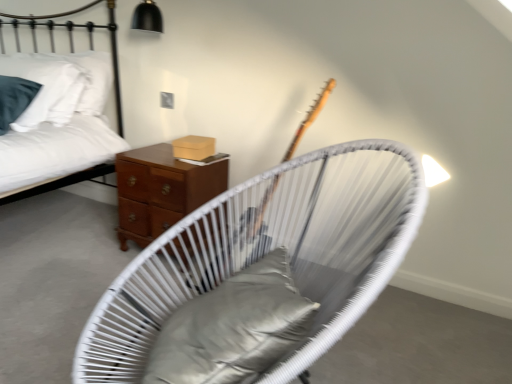
The image size is (512, 384). Describe the element at coordinates (270, 251) in the screenshot. I see `white woven chair at center` at that location.

The image size is (512, 384). I want to click on mahogany wood nightstand at center, so click(161, 191).

The height and width of the screenshot is (384, 512). Describe the element at coordinates (233, 327) in the screenshot. I see `satin gray pillow at center` at that location.

Find the location of `satin gray pillow at center`. satin gray pillow at center is located at coordinates (233, 327).

Image resolution: width=512 pixels, height=384 pixels. I want to click on white cotton bed at upper left, so click(x=89, y=43).

In the scene shown: Which object is closer to the camera, white woven chair at center or satin gray pillow at center?

white woven chair at center is in front.

Is white woven chair at center inside the boundaries of satin gray pillow at center, or outside?

white woven chair at center is not inside satin gray pillow at center, it's outside.

From a real-world perspective, between white woven chair at center and satin gray pillow at center, who is vertically lower?

In real-world perspective, white woven chair at center is lower.

Is white cotton bed at upper left facing away from satin gray pillow at center?

No, white cotton bed at upper left is not facing away from satin gray pillow at center.

Consider the image. Is white cotton bed at upper left completely or partially outside of satin gray pillow at center?

Answer: white cotton bed at upper left is positioned outside satin gray pillow at center.

Would you consider white cotton bed at upper left to be distant from satin gray pillow at center?

That's right, there is a large distance between white cotton bed at upper left and satin gray pillow at center.

Does white cotton bed at upper left lie in front of satin gray pillow at center?

No, white cotton bed at upper left is further to the viewer.

Does point (223, 320) come farther from viewer compared to point (168, 222)?

No, (223, 320) is in front of (168, 222).

From a real-world perspective, between satin gray pillow at center and mahogany wood nightstand at center, who is vertically higher?

In real-world perspective, satin gray pillow at center is above.

From the image's perspective, is satin gray pillow at center positioned above or below mahogany wood nightstand at center?

From the image's perspective, satin gray pillow at center appears below mahogany wood nightstand at center.

Is satin gray pillow at center oriented away from mahogany wood nightstand at center?

No, satin gray pillow at center's orientation is not away from mahogany wood nightstand at center.

Locate an element on the screen. The height and width of the screenshot is (384, 512). nightstand that appears behind the white cotton bed at upper left is located at coordinates (161, 191).

Is white cotton bed at upper left to the left or to the right of mahogany wood nightstand at center in the image?

Based on their positions, white cotton bed at upper left is located to the left of mahogany wood nightstand at center.

Considering the relative sizes of white cotton bed at upper left and mahogany wood nightstand at center in the image provided, is white cotton bed at upper left smaller than mahogany wood nightstand at center?

Incorrect, white cotton bed at upper left is not smaller in size than mahogany wood nightstand at center.

From the image's perspective, is white woven chair at center above or below white cotton bed at upper left?

From the image's perspective, white woven chair at center appears below white cotton bed at upper left.

Between white woven chair at center and white cotton bed at upper left, which one has less height?

white cotton bed at upper left.

Is the position of white woven chair at center less distant than that of white cotton bed at upper left?

Yes, the depth of white woven chair at center is less than that of white cotton bed at upper left.

Does satin gray pillow at center lie in front of white cotton bed at upper left?

Yes.

Is satin gray pillow at center positioned beyond the bounds of white cotton bed at upper left?

That's correct, satin gray pillow at center is outside of white cotton bed at upper left.

Which point is more forward, (233,341) or (3,46)?

Point (233,341)

From a real-world perspective, does satin gray pillow at center stand above white cotton bed at upper left?

No, from a real-world perspective, satin gray pillow at center is not on top of white cotton bed at upper left.

Could you tell me if satin gray pillow at center is facing white woven chair at center?

Yes, satin gray pillow at center is oriented towards white woven chair at center.

From the image's perspective, is satin gray pillow at center over white woven chair at center?

Yes, from the image's perspective, satin gray pillow at center is on top of white woven chair at center.

Is the depth of satin gray pillow at center less than that of white woven chair at center?

No, the depth of satin gray pillow at center is greater than that of white woven chair at center.

Does point (206, 336) lie behind point (79, 357)?

No, it is not.

The image size is (512, 384). I want to click on furniture lying in front of the satin gray pillow at center, so click(x=270, y=251).

What are the coordinates of `pillow located on the right of white cotton bed at upper left` in the screenshot? It's located at pyautogui.click(x=233, y=327).

Estimate the real-world distances between objects in this image. Which object is closer to white cotton bed at upper left, satin gray pillow at center or white woven chair at center?

Based on the image, white woven chair at center appears to be nearer to white cotton bed at upper left.

Looking at the image, which one is located further to mahogany wood nightstand at center, white cotton bed at upper left or white woven chair at center?

white woven chair at center lies further to mahogany wood nightstand at center than the other object.

Looking at the image, which one is located closer to satin gray pillow at center, white woven chair at center or white cotton bed at upper left?

white woven chair at center is positioned closer to the anchor satin gray pillow at center.

Looking at the image, which one is located closer to white woven chair at center, mahogany wood nightstand at center or satin gray pillow at center?

satin gray pillow at center lies closer to white woven chair at center than the other object.

When comparing their distances from white woven chair at center, does satin gray pillow at center or white cotton bed at upper left seem closer?

satin gray pillow at center lies closer to white woven chair at center than the other object.

From the image, which object appears to be farther from mahogany wood nightstand at center, satin gray pillow at center or white woven chair at center?

satin gray pillow at center.

Based on their spatial positions, is white cotton bed at upper left or white woven chair at center closer to satin gray pillow at center?

The object closer to satin gray pillow at center is white woven chair at center.

Considering their positions, is white woven chair at center positioned further to satin gray pillow at center than mahogany wood nightstand at center?

Among the two, mahogany wood nightstand at center is located further to satin gray pillow at center.

Where is `pillow between white woven chair at center and mahogany wood nightstand at center in the front-back direction`? pillow between white woven chair at center and mahogany wood nightstand at center in the front-back direction is located at coordinates (233, 327).

Where is `nightstand situated between white cotton bed at upper left and satin gray pillow at center from left to right`? nightstand situated between white cotton bed at upper left and satin gray pillow at center from left to right is located at coordinates (161, 191).

Where is `bed between white woven chair at center and mahogany wood nightstand at center in the front-back direction`? bed between white woven chair at center and mahogany wood nightstand at center in the front-back direction is located at coordinates (89, 43).

Identify the location of pillow situated between white cotton bed at upper left and white woven chair at center from left to right. (233, 327).